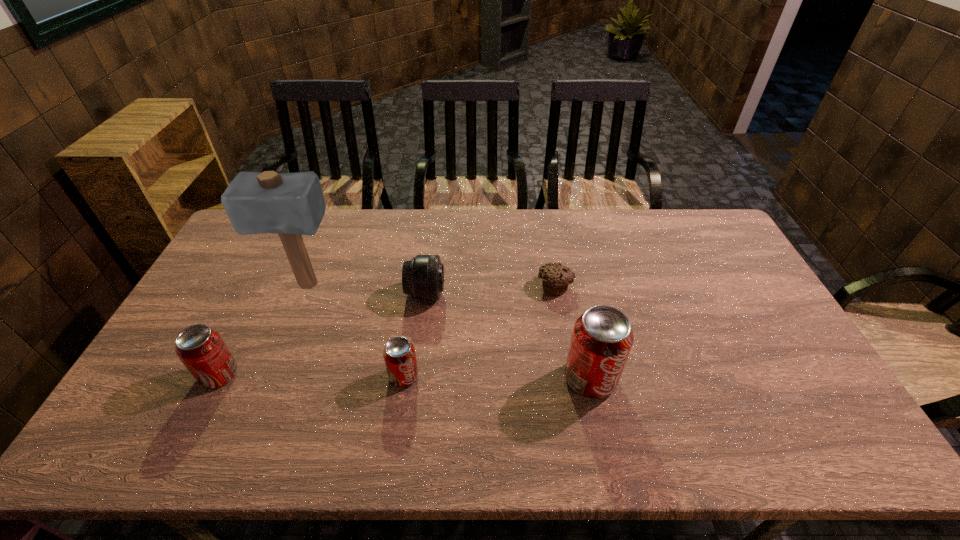
Please point a spot to add another soda can on the right. Please provide its 2D coordinates. Your answer should be formatted as a tuple, i.e. [(x, y)], where the tuple contains the x and y coordinates of a point satisfying the conditions above.

[(778, 381)]